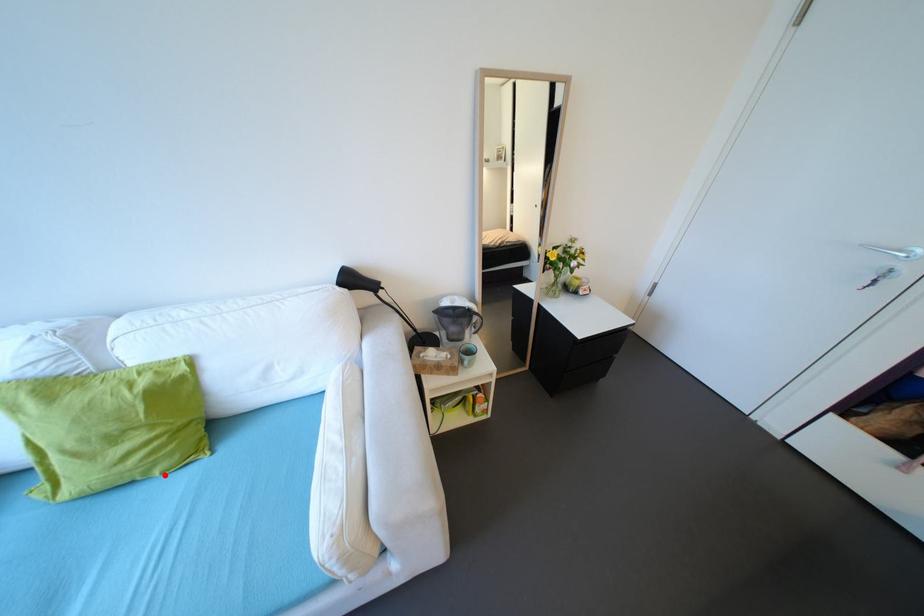
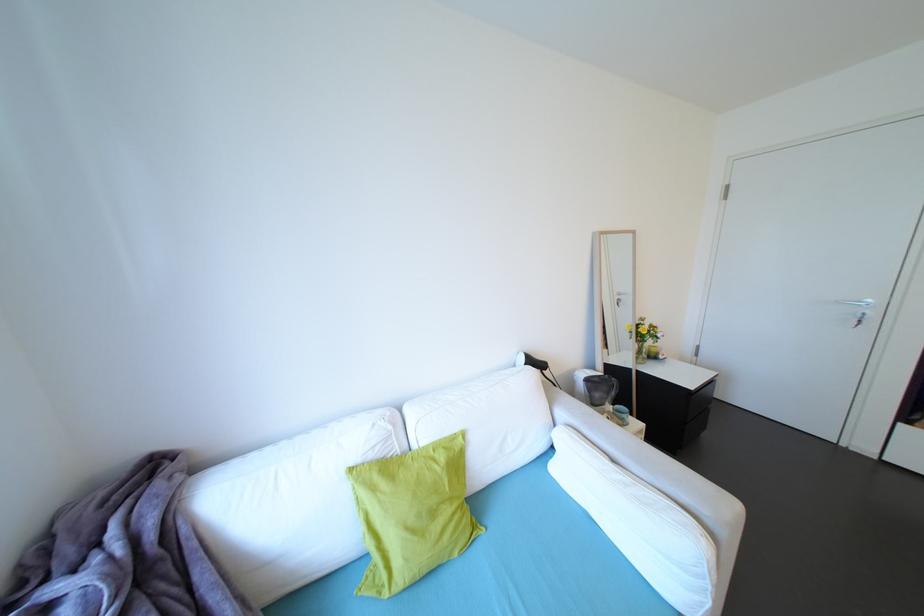
The point at the highlighted location is marked in the first image. Where is the corresponding point in the second image?

(464, 556)